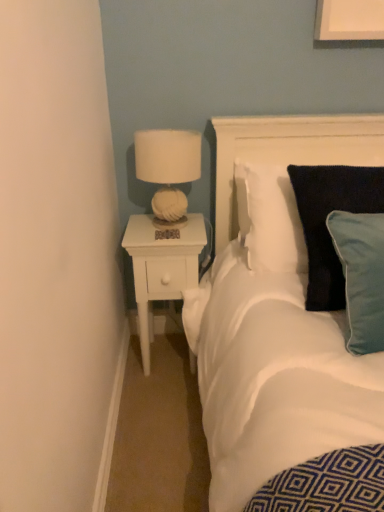
Measure the distance between point (295,184) and camera.

Point (295,184) is 4.48 feet from camera.

The image size is (384, 512). What are the coordinates of `white fabric lampshade at upper right` in the screenshot? It's located at (168, 167).

At what (x,y) coordinates should I click in order to perform the action: click on velvety dark blue pillow at right. Please return your answer as a coordinate pair (x, y). Image resolution: width=384 pixels, height=512 pixels. Looking at the image, I should click on (325, 222).

From a real-world perspective, is white fabric lampshade at upper right physically located above or below white wood nightstand at left?

Clearly, from a real-world perspective, white fabric lampshade at upper right is above white wood nightstand at left.

From the image's perspective, which is below, white fabric lampshade at upper right or white wood nightstand at left?

white wood nightstand at left.

Between white fabric lampshade at upper right and white wood nightstand at left, which one has smaller size?

Smaller between the two is white fabric lampshade at upper right.

Which object is further away from the camera taking this photo, white fabric lampshade at upper right or white wood nightstand at left?

white wood nightstand at left is behind.

How many degrees apart are the facing directions of velvety dark blue pillow at right and white wood nightstand at left?

The angle between the facing direction of velvety dark blue pillow at right and the facing direction of white wood nightstand at left is 1.78 degrees.

Would you say velvety dark blue pillow at right is outside white wood nightstand at left?

Indeed, velvety dark blue pillow at right is completely outside white wood nightstand at left.

At what (x,y) coordinates should I click in order to perform the action: click on pillow in front of the white wood nightstand at left. Please return your answer as a coordinate pair (x, y). Image resolution: width=384 pixels, height=512 pixels. Looking at the image, I should click on (325, 222).

Between point (315, 230) and point (141, 258), which one is positioned behind?

The point (141, 258) is behind.

Is white wood nightstand at left thinner than velvety dark blue pillow at right?

Yes.

Is white wood nightstand at left inside the boundaries of velvety dark blue pillow at right, or outside?

white wood nightstand at left is located beyond the bounds of velvety dark blue pillow at right.

Considering the sizes of objects white wood nightstand at left and velvety dark blue pillow at right in the image provided, who is shorter, white wood nightstand at left or velvety dark blue pillow at right?

velvety dark blue pillow at right.

From the picture: From a real-world perspective, is white wood nightstand at left above or below velvety dark blue pillow at right?

Clearly, from a real-world perspective, white wood nightstand at left is below velvety dark blue pillow at right.

Is white fabric lampshade at upper right beside velvety dark blue pillow at right?

No, white fabric lampshade at upper right is not next to velvety dark blue pillow at right.

Where is `pillow below the white fabric lampshade at upper right (from the image's perspective)`? This screenshot has width=384, height=512. pillow below the white fabric lampshade at upper right (from the image's perspective) is located at coordinates (325, 222).

Looking at this image, looking at their sizes, would you say white fabric lampshade at upper right is wider or thinner than velvety dark blue pillow at right?

white fabric lampshade at upper right is thinner than velvety dark blue pillow at right.

Is white fabric headboard at upper right next to white fabric lampshade at upper right?

white fabric headboard at upper right and white fabric lampshade at upper right are clearly separated.

From a real-world perspective, which is physically below, white fabric headboard at upper right or white fabric lampshade at upper right?

white fabric headboard at upper right.

Is white fabric headboard at upper right facing towards white fabric lampshade at upper right?

No, white fabric headboard at upper right is not aimed at white fabric lampshade at upper right.

Consider the image. Is white wood nightstand at left not near white fabric lampshade at upper right?

They are positioned close to each other.

Is white wood nightstand at left smaller than white fabric lampshade at upper right?

No, white wood nightstand at left is not smaller than white fabric lampshade at upper right.

Considering the positions of objects white wood nightstand at left and white fabric lampshade at upper right in the image provided, who is more to the right, white wood nightstand at left or white fabric lampshade at upper right?

white fabric lampshade at upper right.

In the image, is white wood nightstand at left positioned in front of or behind white fabric lampshade at upper right?

white wood nightstand at left is behind white fabric lampshade at upper right.

From a real-world perspective, is white fabric headboard at upper right physically located above or below white wood nightstand at left?

white fabric headboard at upper right is above white wood nightstand at left.

From the image's perspective, which object appears higher, white fabric headboard at upper right or white wood nightstand at left?

white fabric headboard at upper right, from the image's perspective.

Find the location of `nightstand below the white fabric headboard at upper right (from a real-world perspective)`. nightstand below the white fabric headboard at upper right (from a real-world perspective) is located at coordinates (162, 264).

Identify the location of lamp above the white wood nightstand at left (from the image's perspective). The height and width of the screenshot is (512, 384). (168, 167).

I want to click on pillow located in front of the white wood nightstand at left, so click(325, 222).

Looking at the image, which one is located further to white wood nightstand at left, white fabric headboard at upper right or velvety dark blue pillow at right?

velvety dark blue pillow at right lies further to white wood nightstand at left than the other object.

Which object lies further to the anchor point white fabric headboard at upper right, white wood nightstand at left or velvety dark blue pillow at right?

velvety dark blue pillow at right lies further to white fabric headboard at upper right than the other object.

From the image, which object appears to be farther from white fabric lampshade at upper right, white fabric headboard at upper right or white wood nightstand at left?

The object further to white fabric lampshade at upper right is white fabric headboard at upper right.

When comparing their distances from white fabric lampshade at upper right, does white wood nightstand at left or velvety dark blue pillow at right seem further?

velvety dark blue pillow at right lies further to white fabric lampshade at upper right than the other object.

Consider the image. Based on their spatial positions, is white wood nightstand at left or white fabric headboard at upper right further from white fabric lampshade at upper right?

white fabric headboard at upper right is positioned further to the anchor white fabric lampshade at upper right.

Estimate the real-world distances between objects in this image. Which object is closer to white fabric headboard at upper right, velvety dark blue pillow at right or white wood nightstand at left?

white wood nightstand at left is positioned closer to the anchor white fabric headboard at upper right.

In the scene shown: Based on their spatial positions, is velvety dark blue pillow at right or white wood nightstand at left further from white fabric lampshade at upper right?

velvety dark blue pillow at right is further to white fabric lampshade at upper right.

From the image, which object appears to be nearer to white wood nightstand at left, white fabric lampshade at upper right or velvety dark blue pillow at right?

white fabric lampshade at upper right is positioned closer to the anchor white wood nightstand at left.

Identify the location of headboard between velvety dark blue pillow at right and white wood nightstand at left from front to back. This screenshot has width=384, height=512. (288, 150).

I want to click on headboard located between velvety dark blue pillow at right and white fabric lampshade at upper right in the depth direction, so click(288, 150).

At what (x,y) coordinates should I click in order to perform the action: click on lamp between velvety dark blue pillow at right and white wood nightstand at left in the front-back direction. Please return your answer as a coordinate pair (x, y). This screenshot has height=512, width=384. Looking at the image, I should click on (168, 167).

Where is `lamp located between white wood nightstand at left and white fabric headboard at upper right in the left-right direction`? lamp located between white wood nightstand at left and white fabric headboard at upper right in the left-right direction is located at coordinates (168, 167).